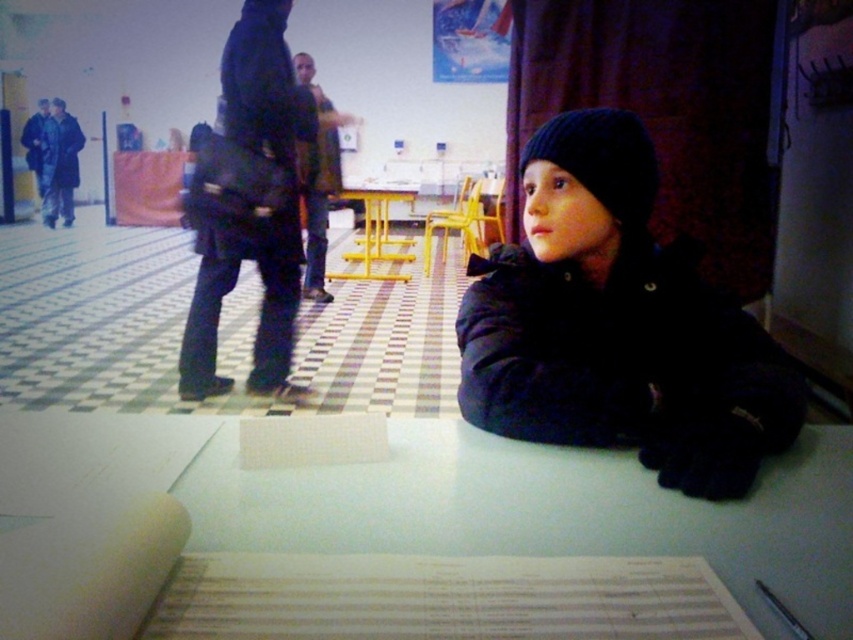
Does black matte uniform at center appear on the right side of black knitted hat at center?

In fact, black matte uniform at center is to the left of black knitted hat at center.

Is point (270, 13) in front of point (550, 150)?

No.

Between point (268, 60) and point (637, 228), which one is positioned behind?

The point (268, 60) is more distant.

Find the location of a particular element. The image size is (853, 640). black matte uniform at center is located at coordinates (252, 208).

Is black matte uniform at center positioned behind yellow metal table at center?

No, black matte uniform at center is in front of yellow metal table at center.

Who is positioned more to the left, black matte uniform at center or yellow metal table at center?

Positioned to the left is black matte uniform at center.

Is point (247, 35) farther from viewer compared to point (374, 212)?

No, it is in front of (374, 212).

I want to click on black matte uniform at center, so (x=252, y=208).

Between white paper at center and black knitted hat at center, which one is positioned higher?

Positioned higher is black knitted hat at center.

Is white paper at center smaller than black knitted hat at center?

No, white paper at center is not smaller than black knitted hat at center.

Does point (442, 525) come closer to viewer compared to point (637, 157)?

Yes, it is in front of point (637, 157).

In order to click on white paper at center in this screenshot , I will do `click(456, 500)`.